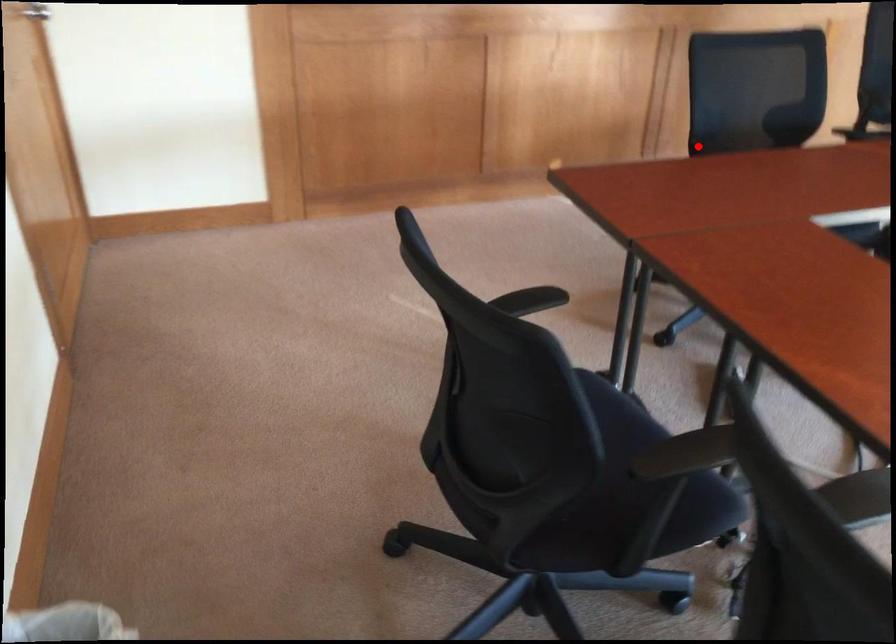
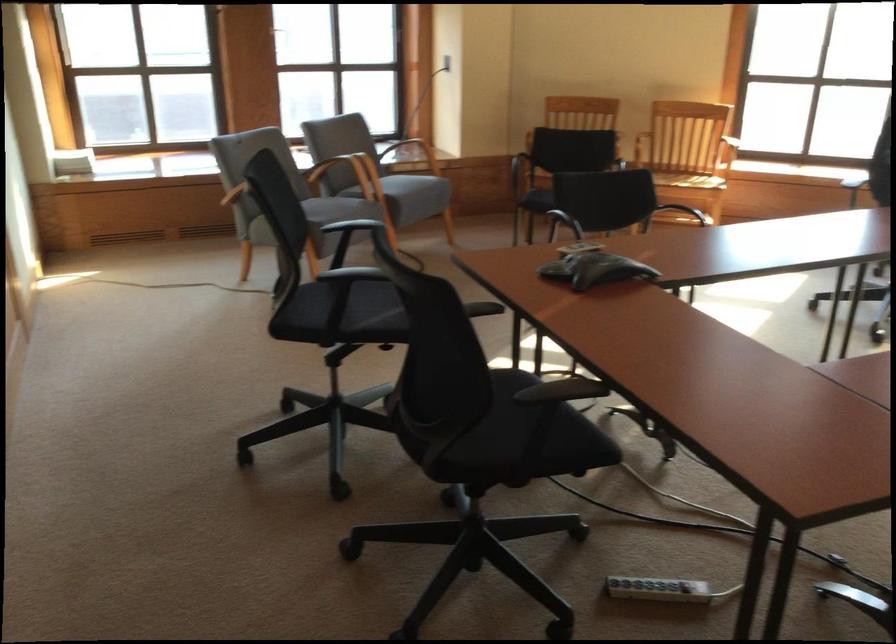
Question: I am providing you with two images of the same scene from different viewpoints. In image1, a red point is highlighted. Considering the same 3D point in image2, which of the following is correct?

Choices:
 (A) It is closer
 (B) It is farther

Answer: (A)